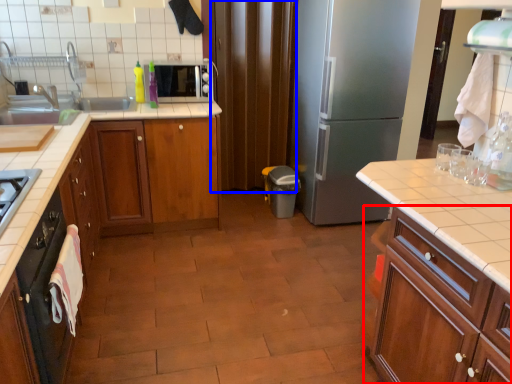
Question: Which object appears closest to the camera in this image, cabinetry (highlighted by a red box) or curtain (highlighted by a blue box)?

Choices:
 (A) cabinetry
 (B) curtain

Answer: (A)